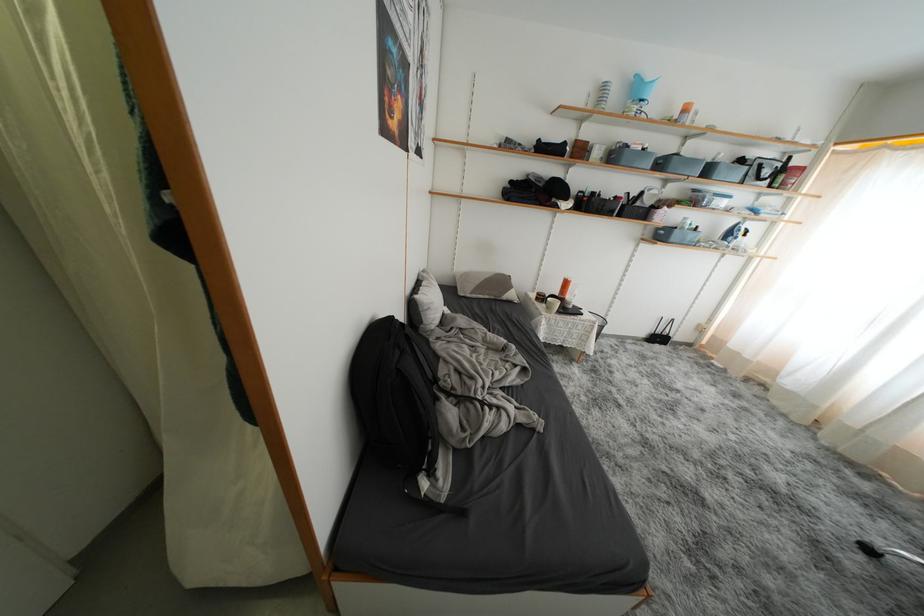
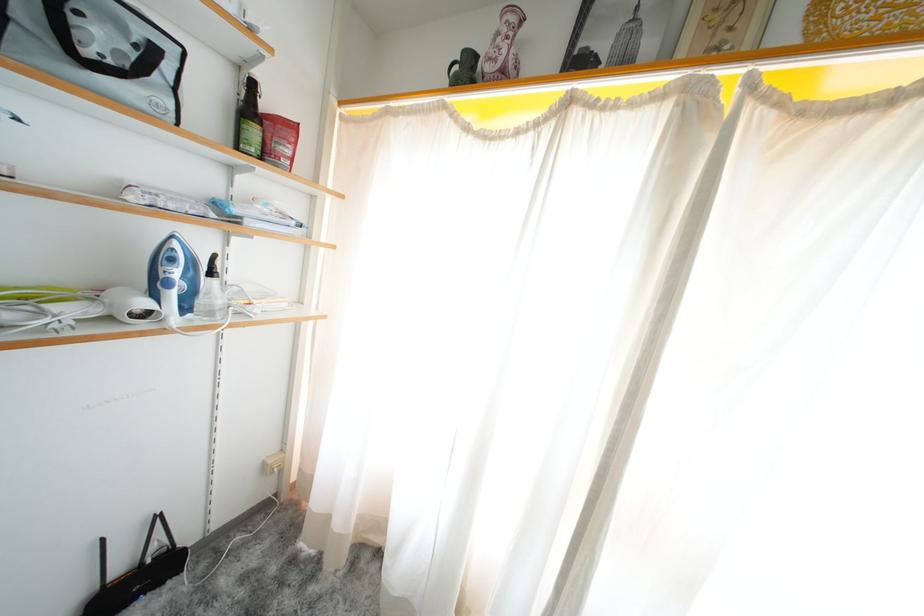
The point at (664, 342) is marked in the first image. Where is the corresponding point in the second image?

(143, 586)